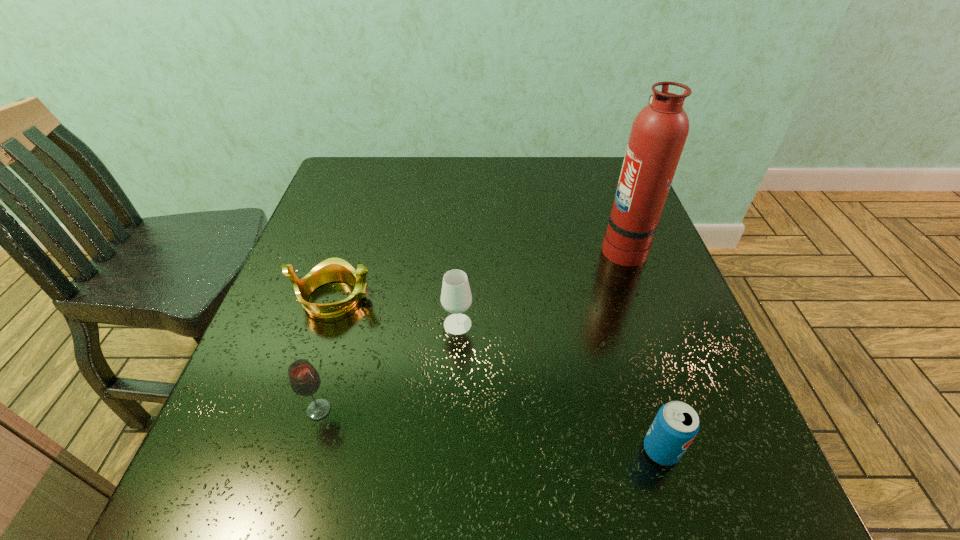
Locate an element on the screen. This screenshot has height=540, width=960. free point that satisfies the following two spatial constraints: 1. at the front emblem of the tiara; 2. on the right side of the nearest object is located at coordinates (285, 450).

Locate an element on the screen. The image size is (960, 540). blank space that satisfies the following two spatial constraints: 1. on the back side of the right glass drink container; 2. at the front emblem of the tiara is located at coordinates (459, 298).

Image resolution: width=960 pixels, height=540 pixels. I want to click on vacant area that satisfies the following two spatial constraints: 1. on the back side of the nearer glass drink container; 2. on the left side of the third object from left to right, so click(344, 324).

This screenshot has width=960, height=540. Identify the location of vacant region that satisfies the following two spatial constraints: 1. on the back side of the nearer glass drink container; 2. on the left side of the right glass drink container. (344, 324).

Find the location of a particular element. vacant space that satisfies the following two spatial constraints: 1. at the front emblem of the tiara; 2. on the left side of the nearest object is located at coordinates (285, 450).

Identify the location of vacant region that satisfies the following two spatial constraints: 1. at the front emblem of the third object from right to left; 2. on the left side of the tiara. The image size is (960, 540). (325, 324).

At what (x,y) coordinates should I click in order to perform the action: click on blank area in the image that satisfies the following two spatial constraints: 1. on the label side of the fire extinguisher; 2. on the front side of the left glass drink container. Please return your answer as a coordinate pair (x, y). The height and width of the screenshot is (540, 960). Looking at the image, I should click on (682, 410).

Identify the location of free space in the image that satisfies the following two spatial constraints: 1. at the front emblem of the tiara; 2. on the left side of the farther glass drink container. Image resolution: width=960 pixels, height=540 pixels. (325, 324).

Identify the location of vacant space that satisfies the following two spatial constraints: 1. on the back side of the nearest object; 2. at the front emblem of the tiara. The image size is (960, 540). (615, 298).

Find the location of a particular element. vacant space that satisfies the following two spatial constraints: 1. on the label side of the fire extinguisher; 2. on the front side of the third object from right to left is located at coordinates (651, 324).